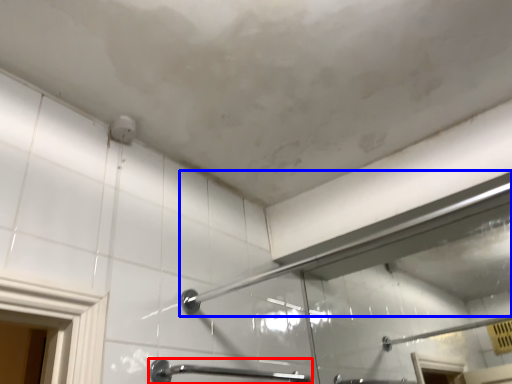
Question: Among these objects, which one is nearest to the camera, door handle (highlighted by a red box) or shower (highlighted by a blue box)?

Choices:
 (A) door handle
 (B) shower

Answer: (B)